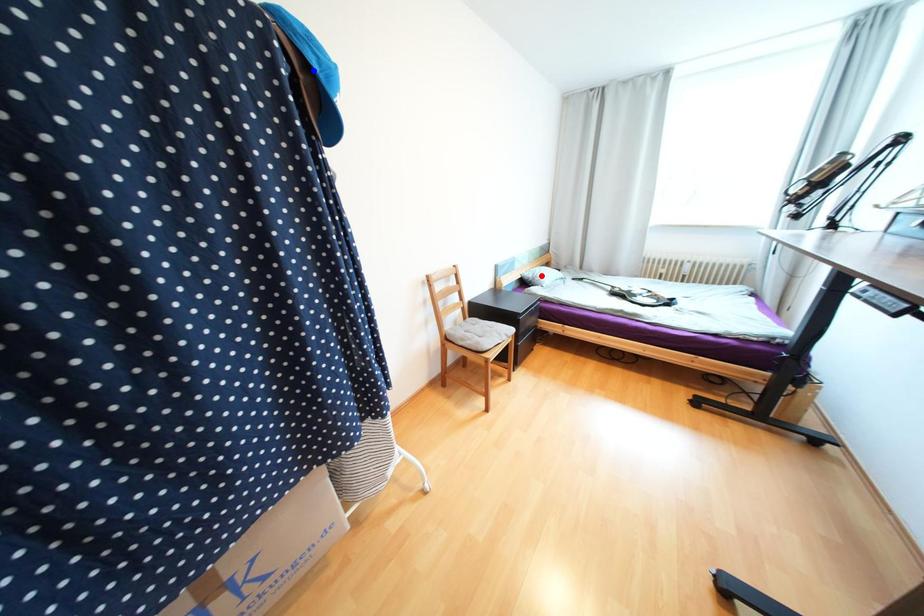
Question: Two points are marked on the image. Which point is closer to the camera?

Choices:
 (A) Blue point is closer.
 (B) Red point is closer.

Answer: (A)